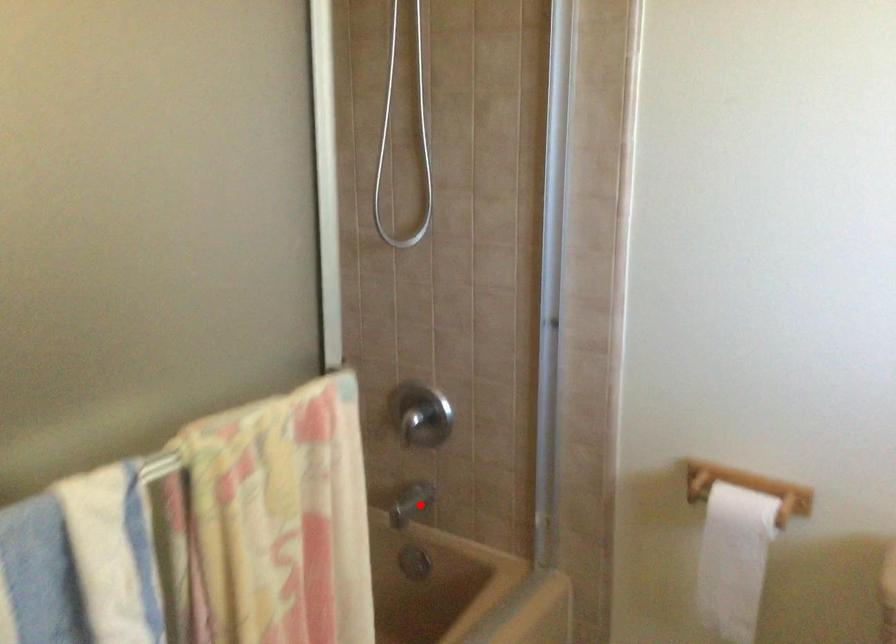
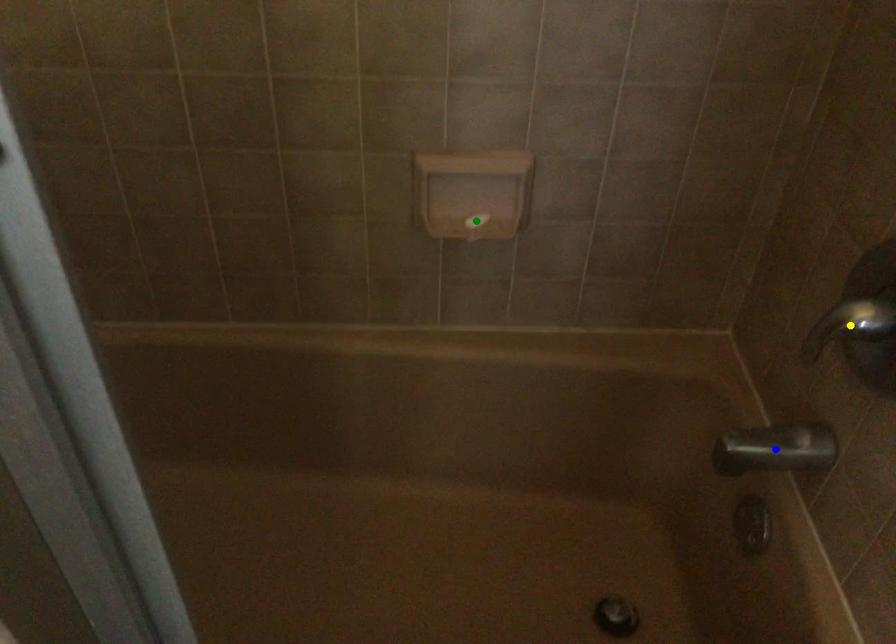
Question: I am providing you with two images of the same scene from different viewpoints. A red point is marked on the first image. You are given multiple points on the second image. Can you choose the point in image 2 that corresponds to the point in image 1?

Choices:
 (A) green point
 (B) yellow point
 (C) blue point

Answer: (C)